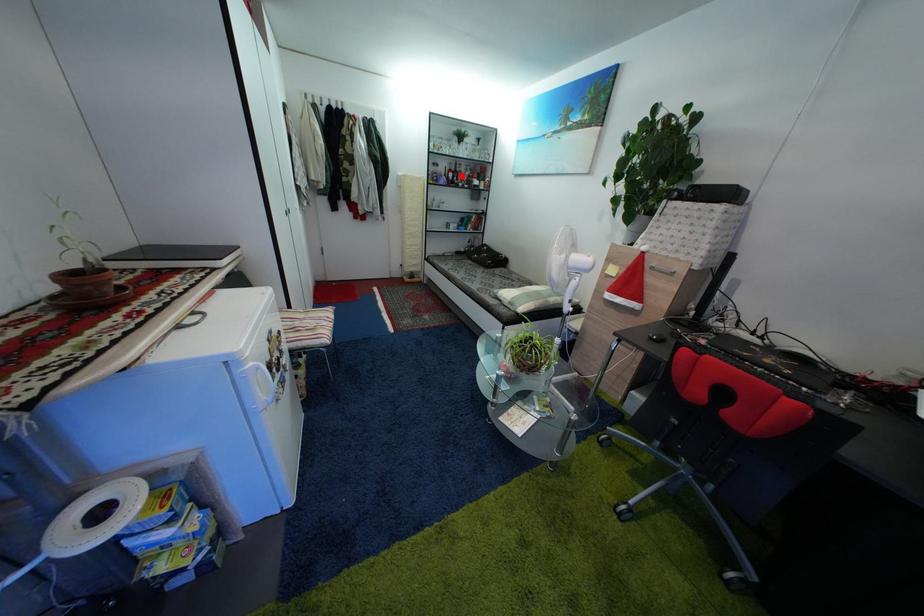
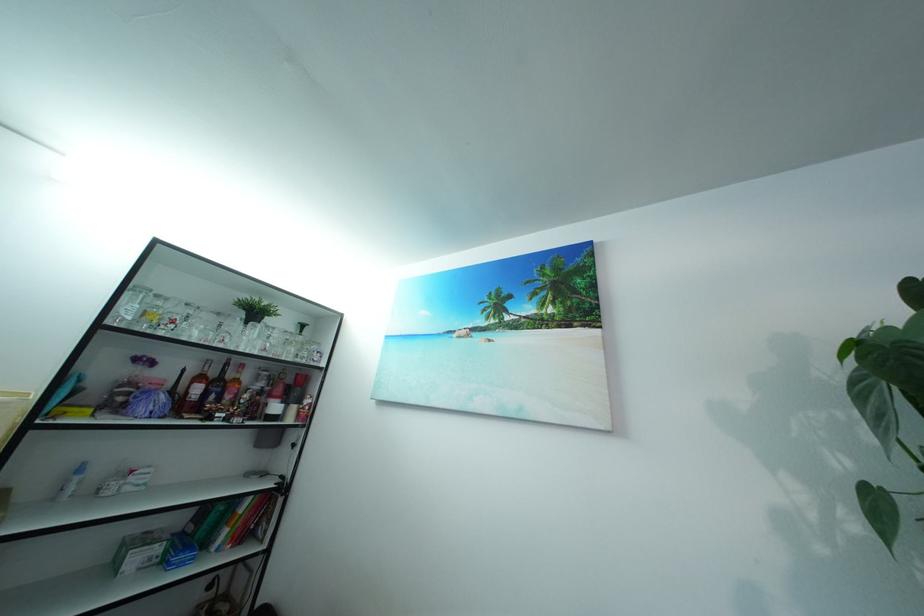
Question: I am providing you with two images of the same scene from different viewpoints. Given a red point in image1, look at the same physical point in image2. Is it:

Choices:
 (A) Closer to the viewpoint
 (B) Farther from the viewpoint

Answer: (B)